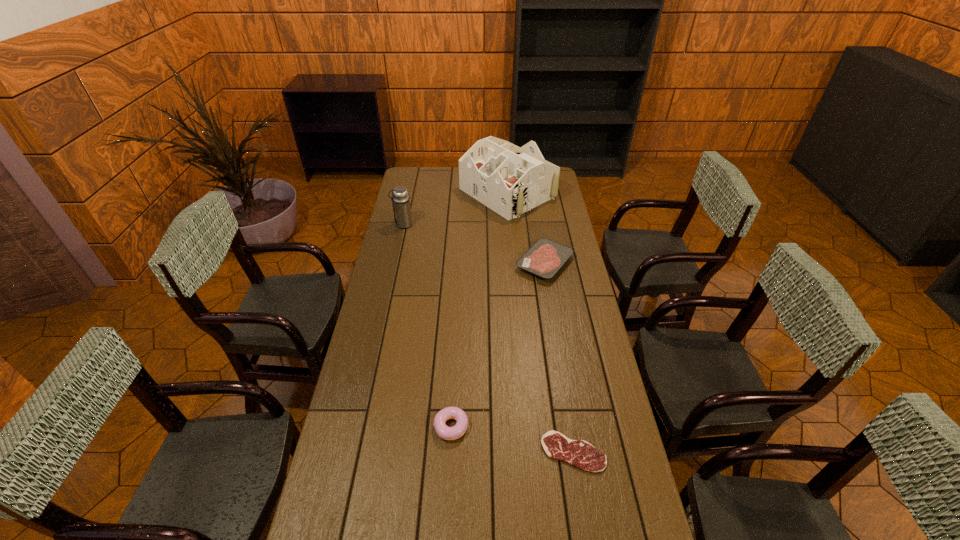
Where is `free region located on the back of the fourth tallest object`? This screenshot has height=540, width=960. free region located on the back of the fourth tallest object is located at coordinates (537, 214).

This screenshot has height=540, width=960. What are the coordinates of `vacant space positioned on the front of the shortest object` in the screenshot? It's located at (584, 516).

The width and height of the screenshot is (960, 540). Identify the location of object located at the far edge. tap(510, 180).

Identify the location of object that is at the left edge. The width and height of the screenshot is (960, 540). (401, 202).

At what (x,y) coordinates should I click in order to perform the action: click on dollhouse located at the right edge. Please return your answer as a coordinate pair (x, y). The width and height of the screenshot is (960, 540). Looking at the image, I should click on (510, 180).

Locate an element on the screen. object that is positioned at the far right corner is located at coordinates pos(510,180).

You are a GUI agent. You are given a task and a screenshot of the screen. Output one action in this format:
    pyautogui.click(x=<x>, y=<y>)
    Task: Click on the vacant space at the far edge
    The height and width of the screenshot is (540, 960).
    Given the screenshot: What is the action you would take?
    pyautogui.click(x=453, y=176)

This screenshot has width=960, height=540. What are the coordinates of `free location at the left edge` in the screenshot? It's located at (391, 255).

Where is `vacant area at the right edge of the desktop`? vacant area at the right edge of the desktop is located at coordinates (588, 334).

Image resolution: width=960 pixels, height=540 pixels. In order to click on free space between the leftmost object and the nearer steak in this screenshot , I will do `click(488, 338)`.